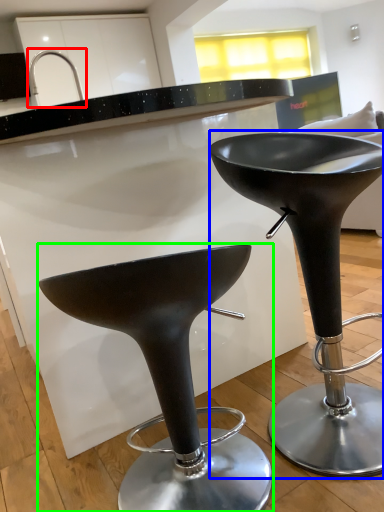
Question: Which is nearer to the faucet (highlighted by a red box)? stool (highlighted by a blue box) or stool (highlighted by a green box).

Choices:
 (A) stool
 (B) stool

Answer: (A)